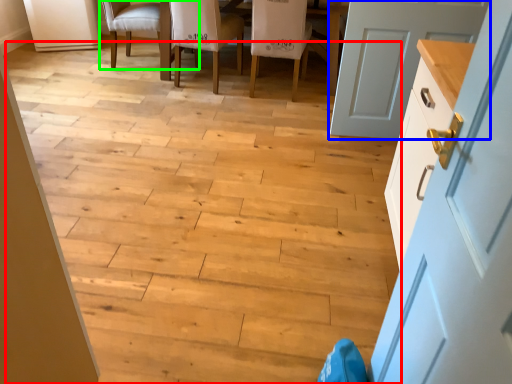
Question: Which object is the closest to the stair (highlighted by a red box)? Choose among these: door (highlighted by a blue box) or chair (highlighted by a green box).

Choices:
 (A) door
 (B) chair

Answer: (A)